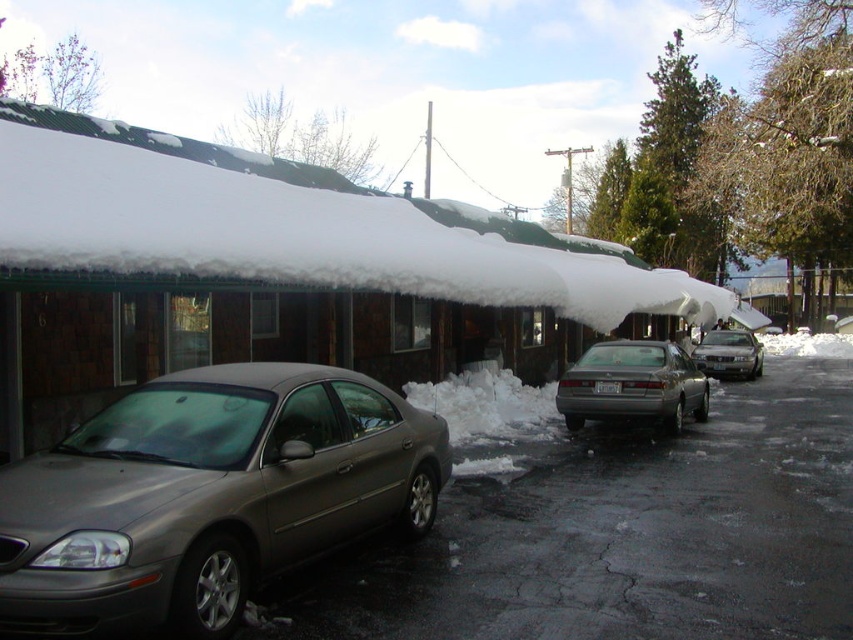
Question: Which point appears closest to the camera in this image?

Choices:
 (A) (x=370, y=240)
 (B) (x=747, y=358)

Answer: (A)

Question: Is satin metallic sedan at center smaller than matte gray sedan at center?

Choices:
 (A) no
 (B) yes

Answer: (A)

Question: From the image, what is the correct spatial relationship of satin metallic sedan at center in relation to white fluffy snow at upper left?

Choices:
 (A) right
 (B) left

Answer: (B)

Question: Which point is farther to the camera?

Choices:
 (A) silver metallic sedan at right
 (B) white fluffy snow at upper left

Answer: (A)

Question: Does white fluffy snow at upper left have a smaller size compared to matte gray sedan at center?

Choices:
 (A) yes
 (B) no

Answer: (B)

Question: Which object appears farthest from the camera in this image?

Choices:
 (A) satin metallic sedan at center
 (B) white fluffy snow at upper left

Answer: (B)